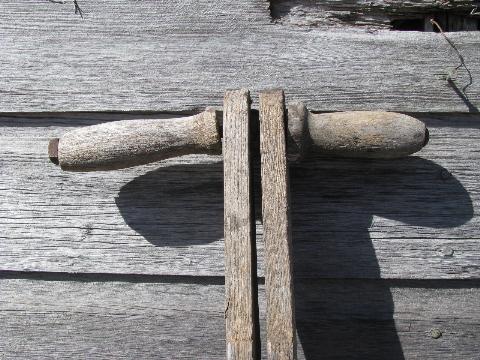
The width and height of the screenshot is (480, 360). Find the location of `wood plank`. wood plank is located at coordinates (111, 56), (66, 232), (129, 326), (412, 254), (416, 328).